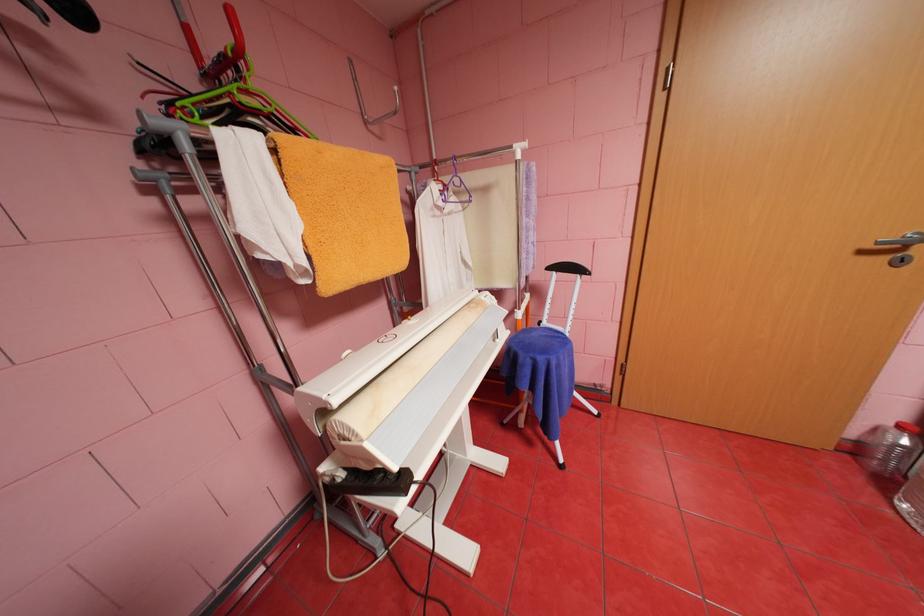
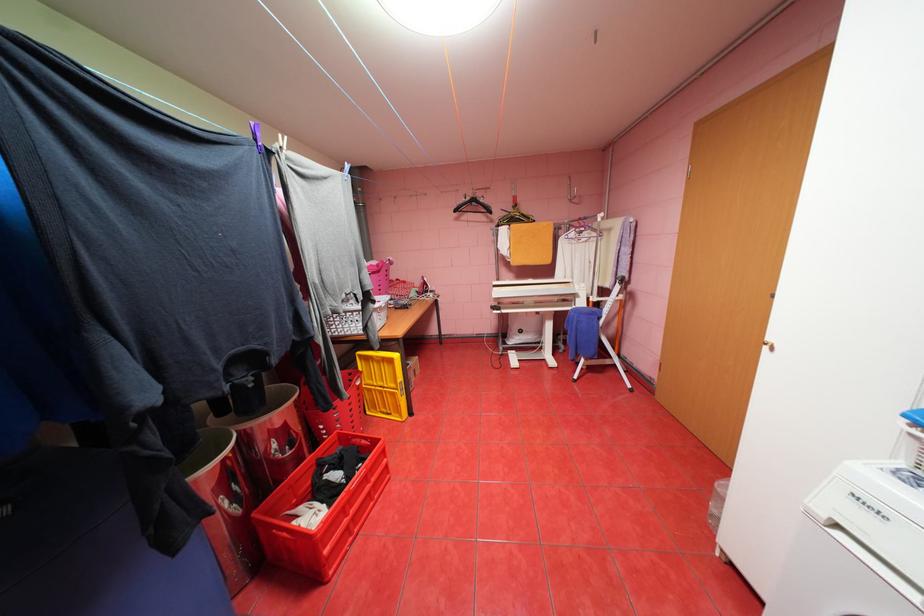
Find the pixel in the second image that matches point (96, 111) in the first image.

(500, 221)